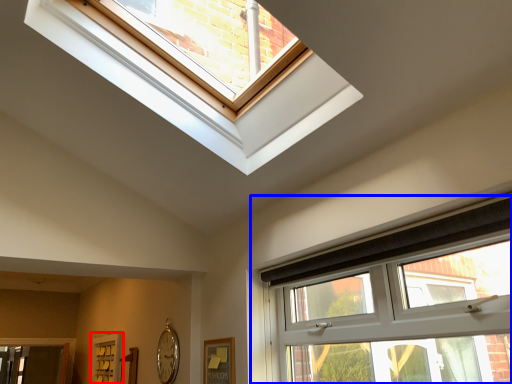
Question: Which point is closer to the camera, screen door (highlighted by a red box) or window (highlighted by a blue box)?

Choices:
 (A) screen door
 (B) window

Answer: (B)